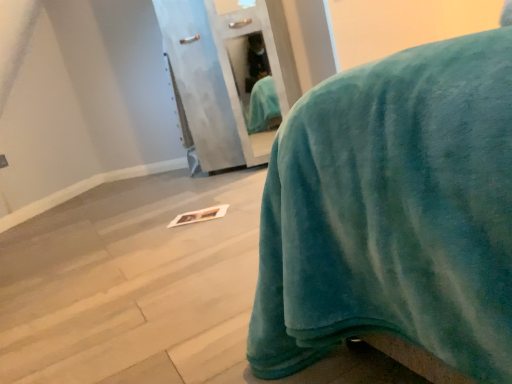
In order to face clear glass door at center, should I rotate leftwards or rightwards?

To face it directly, rotate left by 10.132 degrees.

The width and height of the screenshot is (512, 384). What are the coordinates of `clear glass door at center` in the screenshot? It's located at (199, 84).

This screenshot has width=512, height=384. Describe the element at coordinates (199, 84) in the screenshot. I see `clear glass door at center` at that location.

Locate an element on the screen. clear glass door at center is located at coordinates click(199, 84).